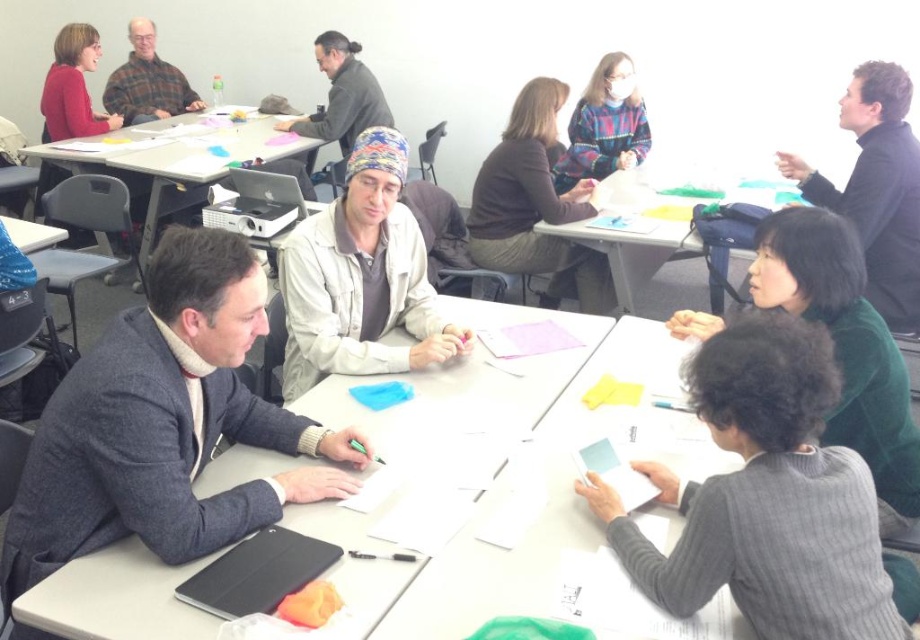
Is white plastic table at center positioned at the back of matte red sweater at upper left?

That is False.

Image resolution: width=920 pixels, height=640 pixels. I want to click on white plastic table at center, so click(x=179, y=157).

In order to click on white plastic table at center in this screenshot , I will do `click(179, 157)`.

Does white plastic table at center have a greater width compared to plaid flannel shirt at upper left?

Yes.

Does white plastic table at center have a smaller size compared to plaid flannel shirt at upper left?

Actually, white plastic table at center might be larger than plaid flannel shirt at upper left.

Which is behind, point (210, 124) or point (150, 74)?

Point (150, 74)

I want to click on white plastic table at center, so click(179, 157).

Is white paper at center smaller than black matte jacket at upper right?

No, white paper at center is not smaller than black matte jacket at upper right.

The height and width of the screenshot is (640, 920). In order to click on white paper at center in this screenshot , I will do `click(501, 484)`.

This screenshot has height=640, width=920. I want to click on white paper at center, so click(x=501, y=484).